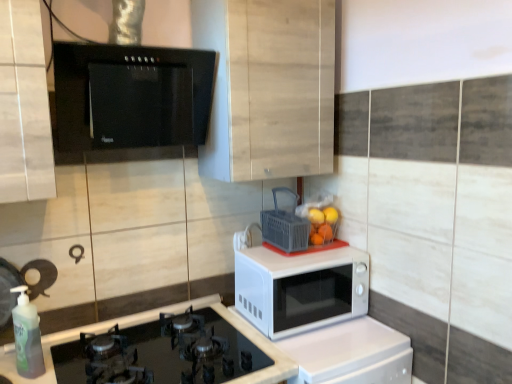
What do you see at coordinates (161, 352) in the screenshot?
I see `black glass gas stove at lower left` at bounding box center [161, 352].

I want to click on black glass range hood at upper center, so click(x=130, y=97).

Describe the element at coordinates (330, 215) in the screenshot. This screenshot has height=384, width=512. I see `orange matte at upper right, the 1th orange in the right-to-left sequence` at that location.

The height and width of the screenshot is (384, 512). Describe the element at coordinates (351, 353) in the screenshot. I see `white glossy microwave at center` at that location.

You are a GUI agent. You are given a task and a screenshot of the screen. Output one action in this format:
    pyautogui.click(x=<x>, y=<y>)
    Task: Click on the green translucent bottle at lower left
    This screenshot has width=512, height=384.
    Given the screenshot: What is the action you would take?
    pyautogui.click(x=27, y=336)

Which object is wider, light wood cabinet at upper center or black glass range hood at upper center?

light wood cabinet at upper center.

Where is `appliance that appears below the light wood cabinet at upper center (from the image's perspective)`? Image resolution: width=512 pixels, height=384 pixels. appliance that appears below the light wood cabinet at upper center (from the image's perspective) is located at coordinates (130, 97).

Considering the sizes of objects light wood cabinet at upper center and black glass range hood at upper center in the image provided, who is smaller, light wood cabinet at upper center or black glass range hood at upper center?

With smaller size is black glass range hood at upper center.

Which is correct: light wood cabinet at upper center is inside green translucent bottle at lower left, or outside of it?

The correct answer is: outside.

Can you confirm if light wood cabinet at upper center is bigger than green translucent bottle at lower left?

Correct, light wood cabinet at upper center is larger in size than green translucent bottle at lower left.

Can you confirm if light wood cabinet at upper center is thinner than green translucent bottle at lower left?

Incorrect, the width of light wood cabinet at upper center is not less than that of green translucent bottle at lower left.

Who is more distant, orange matte at upper right, positioned as the first orange in left-to-right order, or white glossy microwave at center?

orange matte at upper right, positioned as the first orange in left-to-right order, is further from the camera.

Is orange matte at upper right, positioned as the first orange in left-to-right order, positioned far away from white glossy microwave at center?

No, orange matte at upper right, positioned as the first orange in left-to-right order, is not far away from white glossy microwave at center.

Can you tell me how much orange matte at upper right, positioned as the first orange in left-to-right order, and white glossy microwave at center differ in facing direction?

They differ by 3.26 degrees in their facing directions.

Consider the image. From the image's perspective, is orange matte at upper right, positioned as the first orange in left-to-right order, on top of white glossy microwave at center?

Yes, from the image's perspective, orange matte at upper right, positioned as the first orange in left-to-right order, is on top of white glossy microwave at center.

Is light wood cabinet at upper center positioned far away from black glass gas stove at lower left?

No, light wood cabinet at upper center is not far from black glass gas stove at lower left.

From a real-world perspective, is light wood cabinet at upper center under black glass gas stove at lower left?

No, from a real-world perspective, light wood cabinet at upper center is not below black glass gas stove at lower left.

Considering the positions of objects light wood cabinet at upper center and black glass gas stove at lower left in the image provided, who is more to the right, light wood cabinet at upper center or black glass gas stove at lower left?

From the viewer's perspective, light wood cabinet at upper center appears more on the right side.

Is there a large distance between green translucent bottle at lower left and white glossy microwave at center?

No, green translucent bottle at lower left is not far away from white glossy microwave at center.

From a real-world perspective, is green translucent bottle at lower left under white glossy microwave at center?

No.

Measure the distance between green translucent bottle at lower left and white glossy microwave at center.

green translucent bottle at lower left is 37.57 inches away from white glossy microwave at center.

Which object is closer to the camera taking this photo, green translucent bottle at lower left or white glossy microwave at center?

Positioned in front is green translucent bottle at lower left.

Which is more to the right, gray plastic basket at center or white matte microwave at center?

From the viewer's perspective, white matte microwave at center appears more on the right side.

From a real-world perspective, which object rests below the other?

white matte microwave at center, from a real-world perspective.

Considering the sizes of objects gray plastic basket at center and white matte microwave at center in the image provided, who is bigger, gray plastic basket at center or white matte microwave at center?

white matte microwave at center is bigger.

Can you confirm if green translucent bottle at lower left is smaller than black glass range hood at upper center?

Indeed, green translucent bottle at lower left has a smaller size compared to black glass range hood at upper center.

In terms of height, does green translucent bottle at lower left look taller or shorter compared to black glass range hood at upper center?

Clearly, green translucent bottle at lower left is shorter compared to black glass range hood at upper center.

Is point (37, 353) positioned in front of point (125, 73)?

No, it is not.

Considering the sizes of objects green translucent bottle at lower left and black glass range hood at upper center in the image provided, who is wider, green translucent bottle at lower left or black glass range hood at upper center?

Wider between the two is black glass range hood at upper center.

Locate an element on the screen. cabinetry above the black glass range hood at upper center (from a real-world perspective) is located at coordinates (268, 87).

Locate an element on the screen. This screenshot has width=512, height=384. cabinetry above the green translucent bottle at lower left (from the image's perspective) is located at coordinates (268, 87).

Based on their spatial positions, is black glass gas stove at lower left or orange matte at upper right, positioned as the first orange in left-to-right order, closer to orange matte at upper right, which ranks as the 2th orange in left-to-right order?

orange matte at upper right, positioned as the first orange in left-to-right order, is closer to orange matte at upper right, which ranks as the 2th orange in left-to-right order.

From the image, which object appears to be farther from black glass range hood at upper center, black glass gas stove at lower left or white matte microwave at center?

black glass gas stove at lower left.

Which object lies further to the anchor point white glossy microwave at center, white matte microwave at center or black glass range hood at upper center?

black glass range hood at upper center is further to white glossy microwave at center.

Considering their positions, is black glass gas stove at lower left positioned further to gray plastic basket at center than white matte microwave at center?

Based on the image, black glass gas stove at lower left appears to be further to gray plastic basket at center.

From the image, which object appears to be nearer to black glass gas stove at lower left, light wood cabinet at upper center or orange matte at upper right, placed as the second orange when sorted from right to left?

Among the two, orange matte at upper right, placed as the second orange when sorted from right to left, is located nearer to black glass gas stove at lower left.

Looking at the image, which one is located closer to gray plastic basket at center, green translucent bottle at lower left or white glossy microwave at center?

The object closer to gray plastic basket at center is white glossy microwave at center.

Looking at this image, considering their positions, is light wood cabinet at upper center positioned further to gray plastic basket at center than orange matte at upper right, the 1th orange in the right-to-left sequence?

light wood cabinet at upper center is further to gray plastic basket at center.

Based on their spatial positions, is green translucent bottle at lower left or black glass range hood at upper center further from black glass gas stove at lower left?

black glass range hood at upper center.

You are a GUI agent. You are given a task and a screenshot of the screen. Output one action in this format:
    pyautogui.click(x=<x>, y=<y>)
    Task: Click on the basket between green translucent bottle at lower left and white matte microwave at center from left to right
    The width and height of the screenshot is (512, 384).
    Given the screenshot: What is the action you would take?
    pyautogui.click(x=285, y=226)

At what (x,y) coordinates should I click in order to perform the action: click on microwave oven between black glass range hood at upper center and orange matte at upper right, the 1th orange in the right-to-left sequence. Please return your answer as a coordinate pair (x, y). This screenshot has height=384, width=512. Looking at the image, I should click on [x=300, y=289].

You are a GUI agent. You are given a task and a screenshot of the screen. Output one action in this format:
    pyautogui.click(x=<x>, y=<y>)
    Task: Click on the basket between light wood cabinet at upper center and black glass gas stove at lower left vertically
    This screenshot has height=384, width=512.
    Given the screenshot: What is the action you would take?
    pyautogui.click(x=285, y=226)

Locate an element on the screen. basket positioned between black glass gas stove at lower left and orange matte at upper right, which ranks as the 2th orange in left-to-right order, from near to far is located at coordinates click(x=285, y=226).